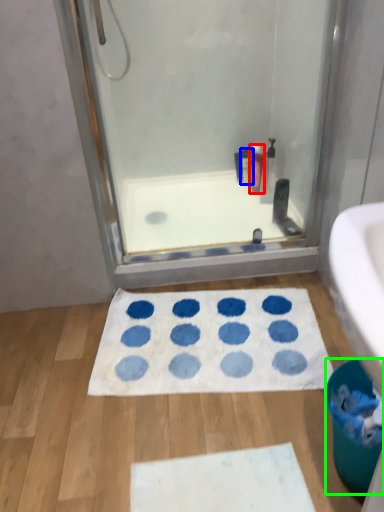
Question: Based on their relative distances, which object is nearer to cleaning product (highlighted by a red box)? Choose from toiletry (highlighted by a blue box) and toilet bowl (highlighted by a green box).

Choices:
 (A) toiletry
 (B) toilet bowl

Answer: (A)